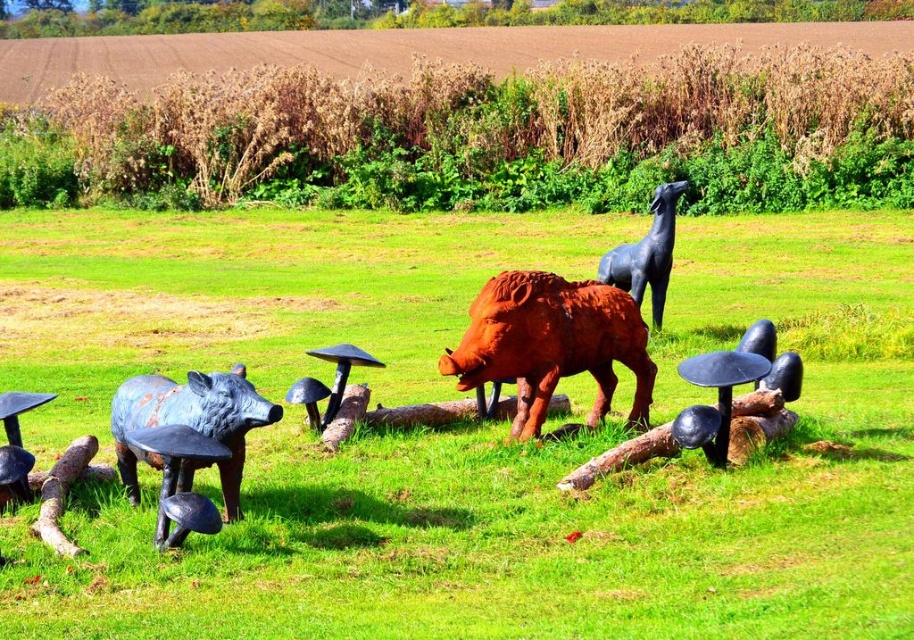
What is located at the coordinates point (189, 426)?

The rusty metal pig at lower left is located at point (189, 426).

You are a visitor at the sculpture garden and want to know which object is taller between the rusty metal pig at lower left and the rusty wood log at lower left. Can you tell me?

The rusty metal pig at lower left is much taller than the rusty wood log at lower left according to the description.

You are a tour guide leading a group near the black glossy horse at center and the brushed metal boar at lower left. Your group wants to know if they can walk between these two sculptures without getting too close. The path between them is 3 meters wide. If the minimum safe distance required is 2 meters from each sculpture, can they safely walk through the path?

The path between the black glossy horse at center and the brushed metal boar at lower left is 3 meters wide. Since the minimum safe distance required is 2 meters from each sculpture, the total required space would be 2 meters on each side, totaling 4 meters. Since 3 meters is less than 4 meters, the path is not wide enough for safe passage.